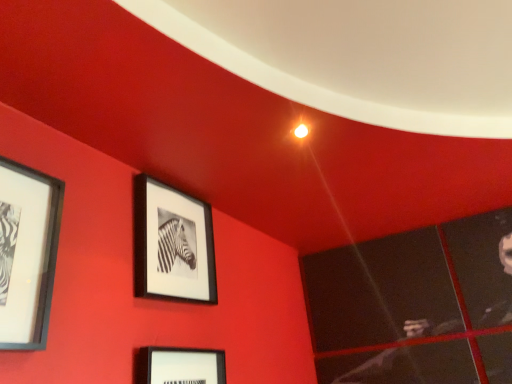
You are a GUI agent. You are given a task and a screenshot of the screen. Output one action in this format:
    pyautogui.click(x=<x>, y=<y>)
    Task: Click on the matte black picture frame at left, which ranks as the 1th picture frame in left-to-right order
    
    Given the screenshot: What is the action you would take?
    pyautogui.click(x=27, y=253)

This screenshot has width=512, height=384. Describe the element at coordinates (27, 253) in the screenshot. I see `matte black picture frame at left, the 2th picture frame when ordered from right to left` at that location.

Locate an element on the screen. The image size is (512, 384). matte black picture frame at center, the first picture frame in the right-to-left sequence is located at coordinates (172, 244).

The width and height of the screenshot is (512, 384). What do you see at coordinates (172, 244) in the screenshot?
I see `matte black picture frame at center, the second picture frame positioned from the left` at bounding box center [172, 244].

This screenshot has height=384, width=512. Identify the location of matte black picture frame at left, acting as the 2th picture frame starting from the back. (27, 253).

Considering the positions of objects matte black picture frame at left, which ranks as the 1th picture frame in left-to-right order, and matte black picture frame at center, the first picture frame in the right-to-left sequence, in the image provided, who is more to the left, matte black picture frame at left, which ranks as the 1th picture frame in left-to-right order, or matte black picture frame at center, the first picture frame in the right-to-left sequence,?

From the viewer's perspective, matte black picture frame at left, which ranks as the 1th picture frame in left-to-right order, appears more on the left side.

In the image, is matte black picture frame at left, which ranks as the 1th picture frame in left-to-right order, positioned in front of or behind matte black picture frame at center, the second picture frame positioned from the left?

Visually, matte black picture frame at left, which ranks as the 1th picture frame in left-to-right order, is located in front of matte black picture frame at center, the second picture frame positioned from the left.

Considering the positions of point (7, 184) and point (167, 253), is point (7, 184) closer or farther from the camera than point (167, 253)?

Point (7, 184) appears to be closer to the viewer than point (167, 253).

From the image's perspective, is matte black picture frame at left, the 2th picture frame when ordered from right to left, located beneath matte black picture frame at center, the second picture frame viewed from the front?

Actually, matte black picture frame at left, the 2th picture frame when ordered from right to left, appears above matte black picture frame at center, the second picture frame viewed from the front, in the image.

From a real-world perspective, is matte black picture frame at left, the 2th picture frame when ordered from right to left, under matte black picture frame at center, the first picture frame in the right-to-left sequence?

Yes.

Considering the sizes of objects matte black picture frame at left, positioned as the first picture frame in front-to-back order, and matte black picture frame at center, the first picture frame viewed from the back, in the image provided, who is thinner, matte black picture frame at left, positioned as the first picture frame in front-to-back order, or matte black picture frame at center, the first picture frame viewed from the back,?

matte black picture frame at center, the first picture frame viewed from the back, is thinner.

Which of these two, matte black picture frame at left, positioned as the first picture frame in front-to-back order, or matte black picture frame at center, the second picture frame viewed from the front, stands shorter?

matte black picture frame at left, positioned as the first picture frame in front-to-back order, is shorter.

Looking at this image, considering the sizes of matte black picture frame at left, positioned as the first picture frame in front-to-back order, and matte black picture frame at center, the second picture frame viewed from the front, in the image, is matte black picture frame at left, positioned as the first picture frame in front-to-back order, bigger or smaller than matte black picture frame at center, the second picture frame viewed from the front,?

matte black picture frame at left, positioned as the first picture frame in front-to-back order, is smaller than matte black picture frame at center, the second picture frame viewed from the front.

Is matte black picture frame at left, acting as the 2th picture frame starting from the back, positioned beyond the bounds of matte black picture frame at center, the first picture frame in the right-to-left sequence?

Yes, matte black picture frame at left, acting as the 2th picture frame starting from the back, is outside of matte black picture frame at center, the first picture frame in the right-to-left sequence.

Is matte black picture frame at left, acting as the 2th picture frame starting from the back, not near matte black picture frame at center, the first picture frame in the right-to-left sequence?

They are positioned close to each other.

Is matte black picture frame at left, acting as the 2th picture frame starting from the back, looking in the opposite direction of matte black picture frame at center, the second picture frame viewed from the front?

No, matte black picture frame at left, acting as the 2th picture frame starting from the back,'s orientation is not away from matte black picture frame at center, the second picture frame viewed from the front.

Measure the distance from matte black picture frame at left, positioned as the first picture frame in front-to-back order, to matte black picture frame at center, the second picture frame positioned from the left.

A distance of 22.87 inches exists between matte black picture frame at left, positioned as the first picture frame in front-to-back order, and matte black picture frame at center, the second picture frame positioned from the left.

At what (x,y) coordinates should I click in order to perform the action: click on picture frame on the right side of matte black picture frame at left, positioned as the first picture frame in front-to-back order. Please return your answer as a coordinate pair (x, y). Looking at the image, I should click on (172, 244).

Which object is positioned more to the right, matte black picture frame at center, the second picture frame viewed from the front, or matte black picture frame at left, positioned as the first picture frame in front-to-back order?

matte black picture frame at center, the second picture frame viewed from the front, is more to the right.

In the image, is matte black picture frame at center, the second picture frame positioned from the left, positioned in front of or behind matte black picture frame at left, acting as the 2th picture frame starting from the back?

Visually, matte black picture frame at center, the second picture frame positioned from the left, is located behind matte black picture frame at left, acting as the 2th picture frame starting from the back.

Does point (192, 270) lie behind point (30, 183)?

That is True.

From the picture: From the image's perspective, relative to matte black picture frame at left, positioned as the first picture frame in front-to-back order, is matte black picture frame at center, the second picture frame viewed from the front, above or below?

matte black picture frame at center, the second picture frame viewed from the front, is below matte black picture frame at left, positioned as the first picture frame in front-to-back order.

From a real-world perspective, is matte black picture frame at center, the first picture frame in the right-to-left sequence, over matte black picture frame at left, the 2th picture frame when ordered from right to left?

Yes, from a real-world perspective, matte black picture frame at center, the first picture frame in the right-to-left sequence, is over matte black picture frame at left, the 2th picture frame when ordered from right to left

Is matte black picture frame at center, the second picture frame viewed from the front, wider than matte black picture frame at left, positioned as the first picture frame in front-to-back order?

In fact, matte black picture frame at center, the second picture frame viewed from the front, might be narrower than matte black picture frame at left, positioned as the first picture frame in front-to-back order.

Which of these two, matte black picture frame at center, the first picture frame viewed from the back, or matte black picture frame at left, which ranks as the 1th picture frame in left-to-right order, stands shorter?

matte black picture frame at left, which ranks as the 1th picture frame in left-to-right order, is shorter.

Does matte black picture frame at center, the first picture frame in the right-to-left sequence, have a larger size compared to matte black picture frame at left, acting as the 2th picture frame starting from the back?

Yes, matte black picture frame at center, the first picture frame in the right-to-left sequence, is bigger than matte black picture frame at left, acting as the 2th picture frame starting from the back.

Can matte black picture frame at left, positioned as the first picture frame in front-to-back order, be found inside matte black picture frame at center, the first picture frame viewed from the back?

Definitely not — matte black picture frame at left, positioned as the first picture frame in front-to-back order, is not inside matte black picture frame at center, the first picture frame viewed from the back.

Is matte black picture frame at center, the second picture frame viewed from the front, not near matte black picture frame at left, positioned as the first picture frame in front-to-back order?

No.

Is matte black picture frame at center, the first picture frame viewed from the back, aimed at matte black picture frame at left, positioned as the first picture frame in front-to-back order?

No, matte black picture frame at center, the first picture frame viewed from the back, is not oriented towards matte black picture frame at left, positioned as the first picture frame in front-to-back order.

What's the angular difference between matte black picture frame at center, the first picture frame in the right-to-left sequence, and matte black picture frame at left, acting as the 2th picture frame starting from the back,'s facing directions?

There is a 0.229-degree angle between the facing directions of matte black picture frame at center, the first picture frame in the right-to-left sequence, and matte black picture frame at left, acting as the 2th picture frame starting from the back.

Looking at this image, how much distance is there between matte black picture frame at center, the second picture frame positioned from the left, and matte black picture frame at left, positioned as the first picture frame in front-to-back order?

They are 22.87 inches apart.

Where is `picture frame located above the matte black picture frame at center, the first picture frame viewed from the back (from the image's perspective)`? picture frame located above the matte black picture frame at center, the first picture frame viewed from the back (from the image's perspective) is located at coordinates (27, 253).

Where is `picture frame that appears above the matte black picture frame at center, the second picture frame viewed from the front (from the image's perspective)`? This screenshot has width=512, height=384. picture frame that appears above the matte black picture frame at center, the second picture frame viewed from the front (from the image's perspective) is located at coordinates (27, 253).

This screenshot has height=384, width=512. Find the location of `picture frame that appears in front of the matte black picture frame at center, the first picture frame viewed from the back`. picture frame that appears in front of the matte black picture frame at center, the first picture frame viewed from the back is located at coordinates (27, 253).